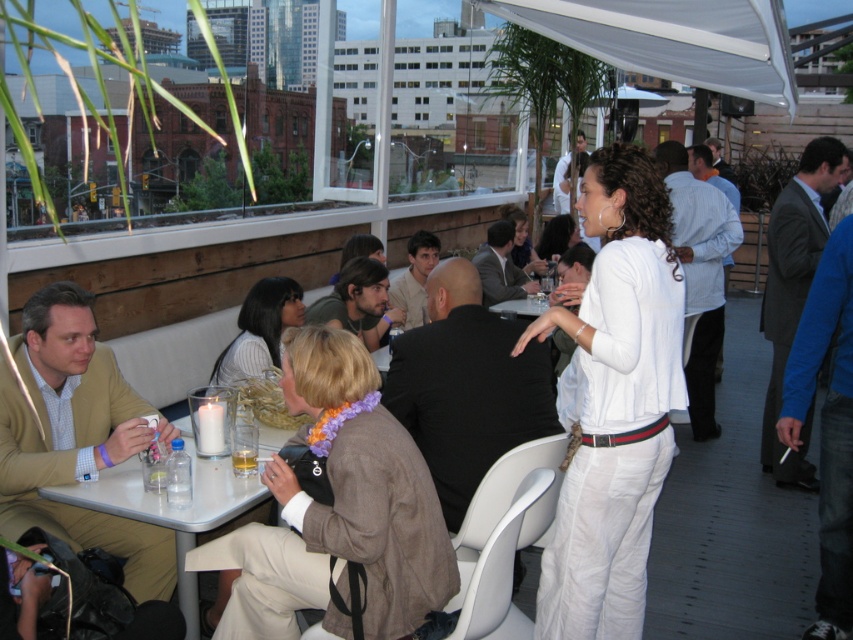
Question: Is beige textured blazer at left below striped fabric blouse at center?

Choices:
 (A) yes
 (B) no

Answer: (A)

Question: Which of the following is the farthest from the observer?

Choices:
 (A) (511, 232)
 (B) (524, 268)
 (C) (286, 369)

Answer: (B)

Question: Which of the following is the closest to the observer?

Choices:
 (A) (514, 204)
 (B) (494, 246)
 (C) (840, 397)
 (D) (456, 531)

Answer: (D)

Question: Can you confirm if matte brown blazer at center is bigger than white fabric canopy at upper center?

Choices:
 (A) yes
 (B) no

Answer: (B)

Question: Is matte brown blazer at center closer to the viewer compared to light blue striped shirt at center?

Choices:
 (A) yes
 (B) no

Answer: (A)

Question: Which object is closer to the camera taking this photo?

Choices:
 (A) matte beige shirt at center
 (B) black smooth suit at center

Answer: (B)